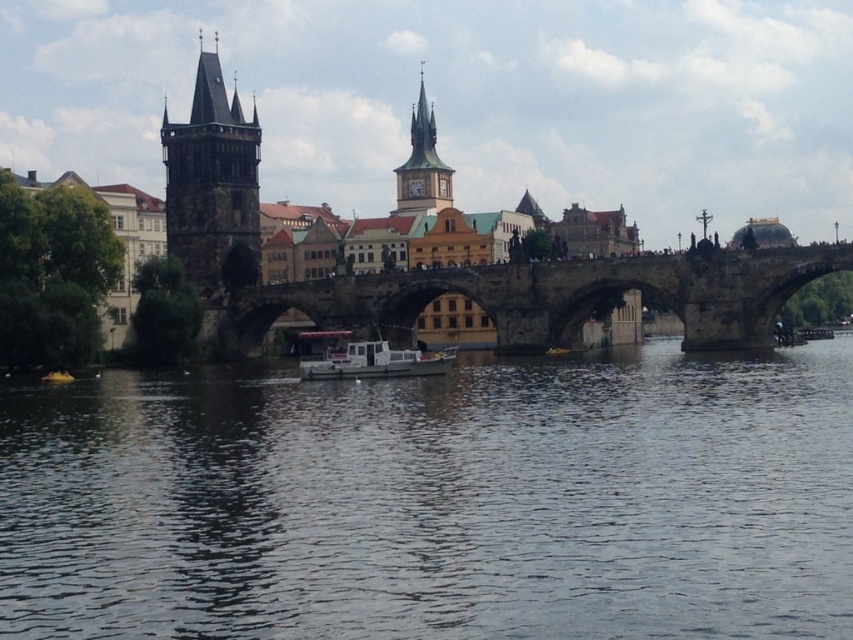
Can you confirm if dark stone tower at left is positioned to the right of golden stone clock tower at upper center?

→ Incorrect, dark stone tower at left is not on the right side of golden stone clock tower at upper center.

Is dark stone tower at left closer to camera compared to golden stone clock tower at upper center?

Yes, it is in front of golden stone clock tower at upper center.

Locate an element on the screen. dark stone tower at left is located at coordinates (212, 186).

Locate an element on the screen. dark stone tower at left is located at coordinates (212, 186).

Between brown stone bridge at center and golden stone clock tower at upper center, which one is positioned higher?

golden stone clock tower at upper center is higher up.

Between brown stone bridge at center and golden stone clock tower at upper center, which one is positioned lower?

brown stone bridge at center

Where is `brown stone bridge at center`? The image size is (853, 640). brown stone bridge at center is located at coordinates (548, 298).

You are a GUI agent. You are given a task and a screenshot of the screen. Output one action in this format:
    pyautogui.click(x=<x>, y=<y>)
    Task: Click on the brown stone bridge at center
    Image resolution: width=853 pixels, height=640 pixels.
    Given the screenshot: What is the action you would take?
    pyautogui.click(x=548, y=298)

Who is lower down, dark blue water at center or white matte boat at center?

Positioned lower is dark blue water at center.

Who is positioned more to the right, dark blue water at center or white matte boat at center?

From the viewer's perspective, dark blue water at center appears more on the right side.

Does point (96, 604) come in front of point (354, 346)?

Yes, point (96, 604) is closer to viewer.

Image resolution: width=853 pixels, height=640 pixels. I want to click on dark blue water at center, so click(436, 500).